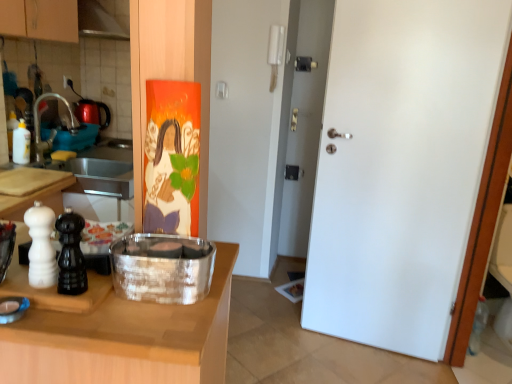
At what (x,y) coordinates should I click in order to perform the action: click on free point below silver metallic container at center (from a real-world perspective). Please return your answer as a coordinate pair (x, y). Looking at the image, I should click on (160, 288).